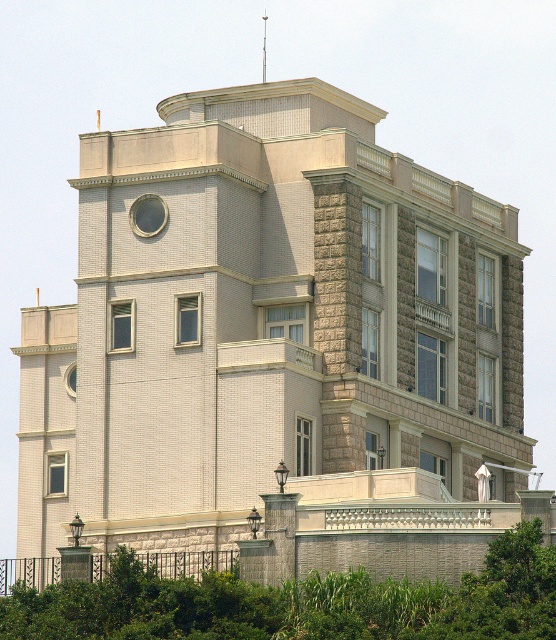
Question: Does green leafy tree at lower center appear over metallic spire at upper center?

Choices:
 (A) no
 (B) yes

Answer: (A)

Question: Can you confirm if green leafy tree at lower center is positioned above metallic spire at upper center?

Choices:
 (A) yes
 (B) no

Answer: (B)

Question: Which point is closer to the camera taking this photo?

Choices:
 (A) (509, 593)
 (B) (264, 42)

Answer: (A)

Question: Is green leafy tree at lower center to the right of metallic spire at upper center from the viewer's perspective?

Choices:
 (A) yes
 (B) no

Answer: (A)